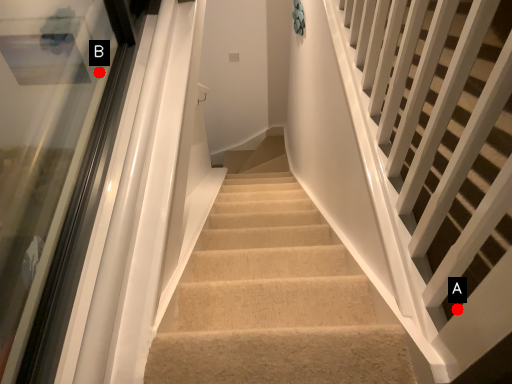
Question: Two points are circled on the image, labeled by A and B beside each circle. Among these points, which one is farthest from the camera?

Choices:
 (A) A is further
 (B) B is further

Answer: (B)